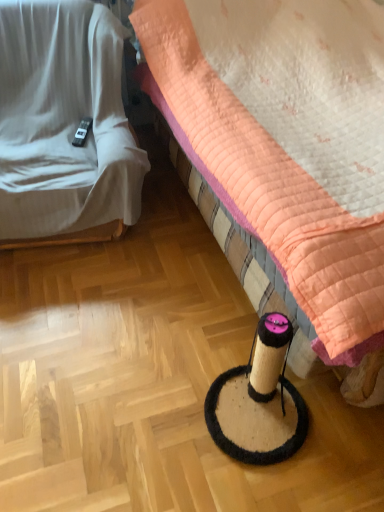
Question: Would you say white fabric couch at left is to the left or to the right of quilted peach bed at center in the picture?

Choices:
 (A) left
 (B) right

Answer: (A)

Question: From a real-world perspective, is white fabric couch at left above or below quilted peach bed at center?

Choices:
 (A) above
 (B) below

Answer: (B)

Question: Considering the positions of white fabric couch at left and quilted peach bed at center in the image, is white fabric couch at left bigger or smaller than quilted peach bed at center?

Choices:
 (A) small
 (B) big

Answer: (A)

Question: Is quilted peach bed at center taller or shorter than white fabric couch at left?

Choices:
 (A) tall
 (B) short

Answer: (A)

Question: Considering the positions of quilted peach bed at center and white fabric couch at left in the image, is quilted peach bed at center wider or thinner than white fabric couch at left?

Choices:
 (A) thin
 (B) wide

Answer: (B)

Question: Is quilted peach bed at center in front of or behind white fabric couch at left in the image?

Choices:
 (A) front
 (B) behind

Answer: (A)

Question: Would you say quilted peach bed at center is inside or outside white fabric couch at left?

Choices:
 (A) outside
 (B) inside

Answer: (A)